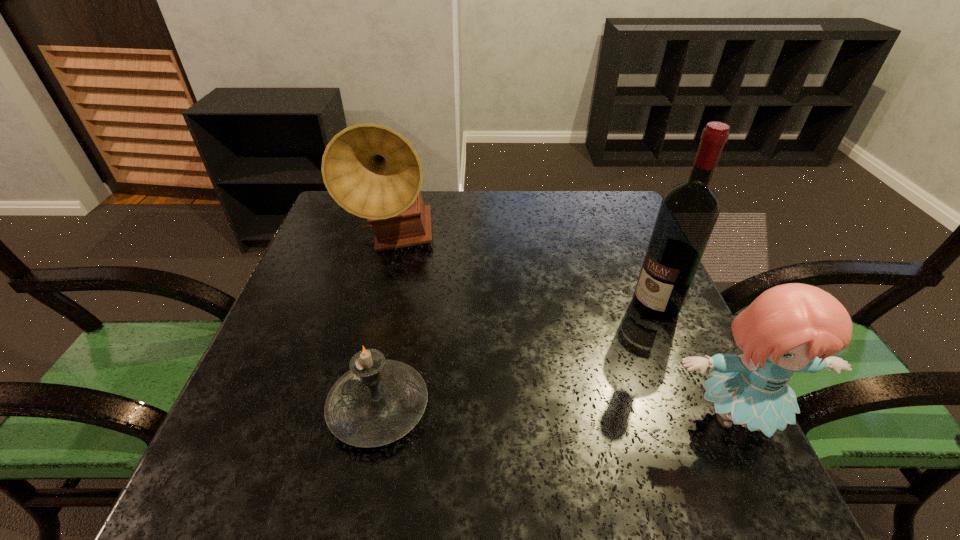
Image resolution: width=960 pixels, height=540 pixels. Find the location of `vacant region located on the front and back of the alcohol`. vacant region located on the front and back of the alcohol is located at coordinates [x=571, y=370].

I want to click on blank space located on the front and back of the alcohol, so click(607, 343).

Locate an element on the screen. object at the far edge is located at coordinates (372, 171).

Find the location of `candle at the near edge`. candle at the near edge is located at coordinates (378, 401).

Identify the location of doll that is at the near edge. (794, 327).

Where is `object that is positioned at the left edge`? object that is positioned at the left edge is located at coordinates (372, 171).

At what (x,y) coordinates should I click in order to perform the action: click on doll situated at the right edge. Please return your answer as a coordinate pair (x, y). The image size is (960, 540). Looking at the image, I should click on (794, 327).

You are a GUI agent. You are given a task and a screenshot of the screen. Output one action in this format:
    pyautogui.click(x=<x>, y=<y>)
    Task: Click on the alcohol present at the right edge
    The image size is (960, 540).
    Given the screenshot: What is the action you would take?
    pyautogui.click(x=688, y=212)

This screenshot has height=540, width=960. I want to click on object that is at the far left corner, so click(372, 171).

The image size is (960, 540). What are the coordinates of `object located in the near right corner section of the desktop` in the screenshot? It's located at (794, 327).